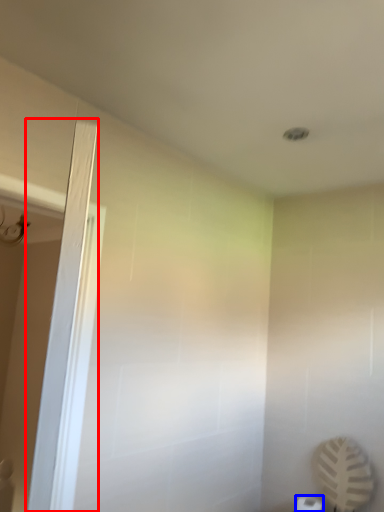
Question: Which point is closer to the camera, screen door (highlighted by a red box) or toilet paper (highlighted by a blue box)?

Choices:
 (A) screen door
 (B) toilet paper

Answer: (A)